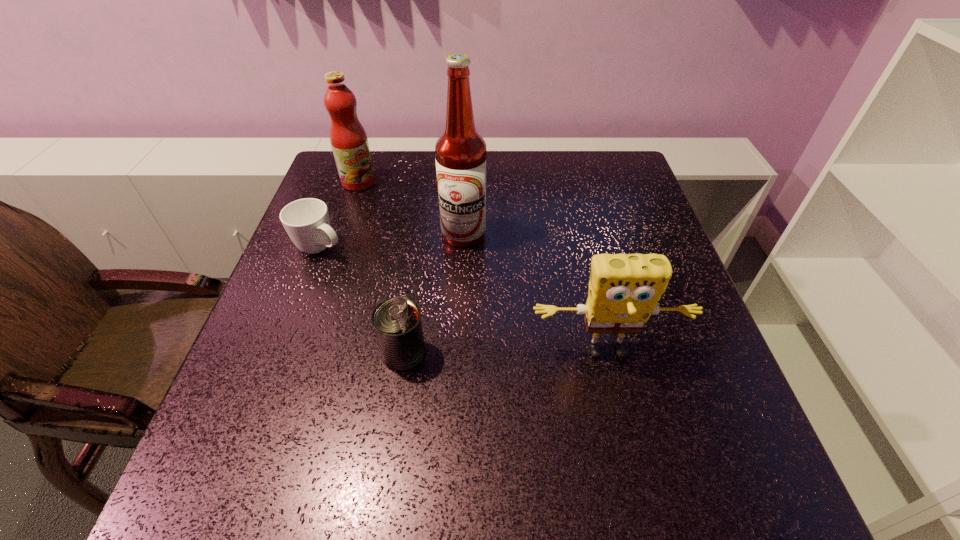
Find the location of `free space on the desktop that is between the third object from left to right and the sponge and is positioned on the label side of the second object from right to left`. free space on the desktop that is between the third object from left to right and the sponge and is positioned on the label side of the second object from right to left is located at coordinates (478, 353).

At what (x,y) coordinates should I click in order to perform the action: click on vacant space on the desktop that is between the third object from left to right and the third tallest object and is positioned with the handle on the side of the shortest object. Please return your answer as a coordinate pair (x, y). This screenshot has height=540, width=960. Looking at the image, I should click on (508, 353).

At what (x,y) coordinates should I click in order to perform the action: click on free space on the desktop that is between the third object from left to right and the third shortest object and is positioned on the front label of the farthest object. Please return your answer as a coordinate pair (x, y). Looking at the image, I should click on (533, 353).